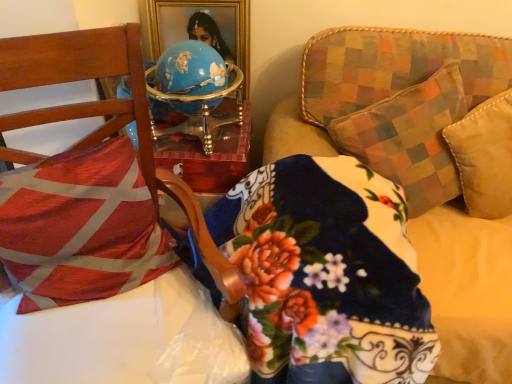
Question: Is wooden chair at left inside the boundaries of fluffy fabric couch at upper right, or outside?

Choices:
 (A) outside
 (B) inside

Answer: (A)

Question: Considering the positions of point (143, 243) and point (454, 288), is point (143, 243) closer or farther from the camera than point (454, 288)?

Choices:
 (A) farther
 (B) closer

Answer: (B)

Question: Estimate the real-world distances between objects in this image. Which object is closer to the wooden chair at left?

Choices:
 (A) red and white fabric pillow at left
 (B) fluffy fabric couch at upper right

Answer: (A)

Question: Considering the real-world distances, which object is closest to the fluffy fabric couch at upper right?

Choices:
 (A) red and white fabric pillow at left
 (B) wooden chair at left

Answer: (B)